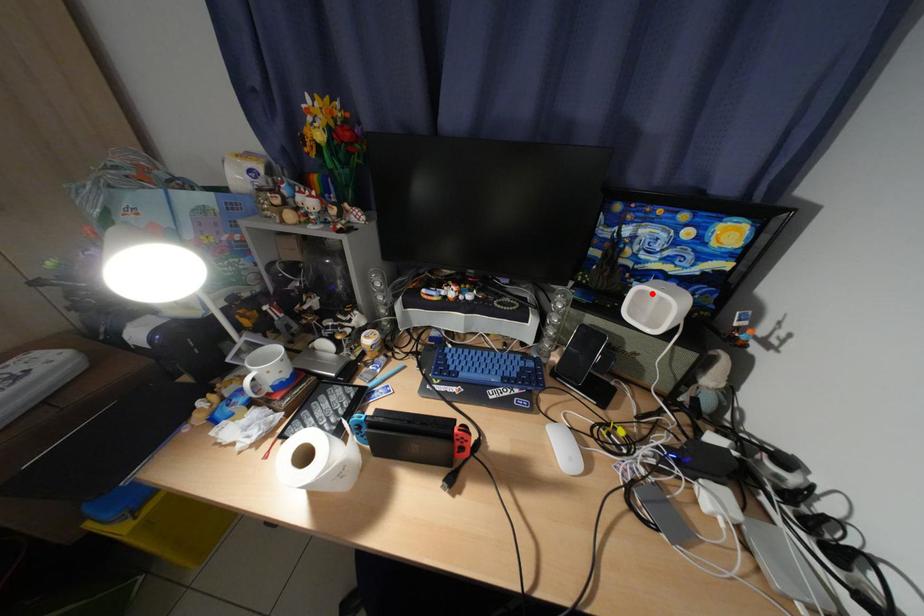
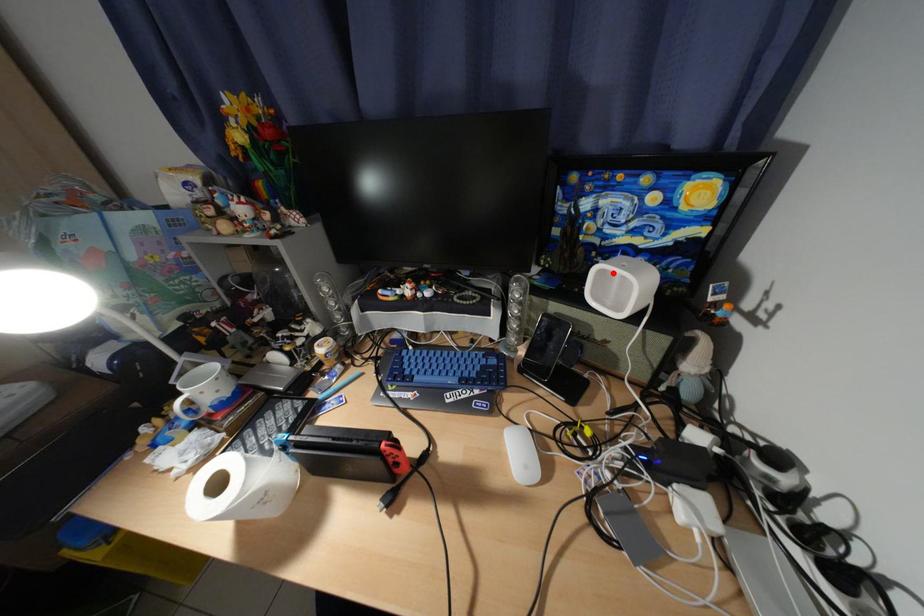
I am providing you with two images of the same scene from different viewpoints. A red point is marked on the first image and another point is marked on the second image. Is the marked point in image1 the same physical position as the marked point in image2?

Yes